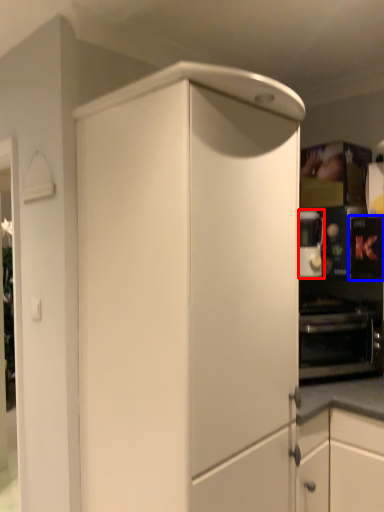
Question: Which point is further to the camera, coffee machine (highlighted by a red box) or appliance (highlighted by a blue box)?

Choices:
 (A) coffee machine
 (B) appliance

Answer: (A)